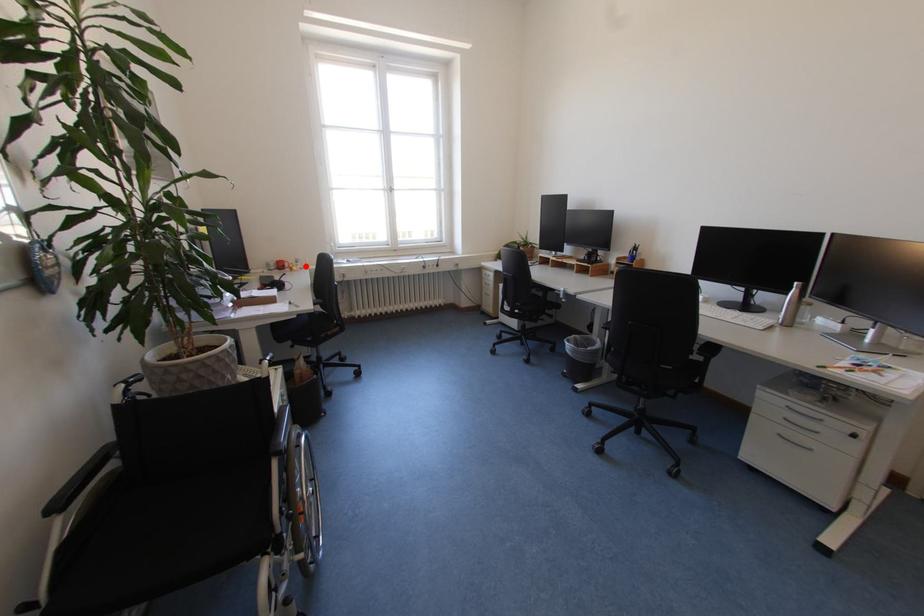
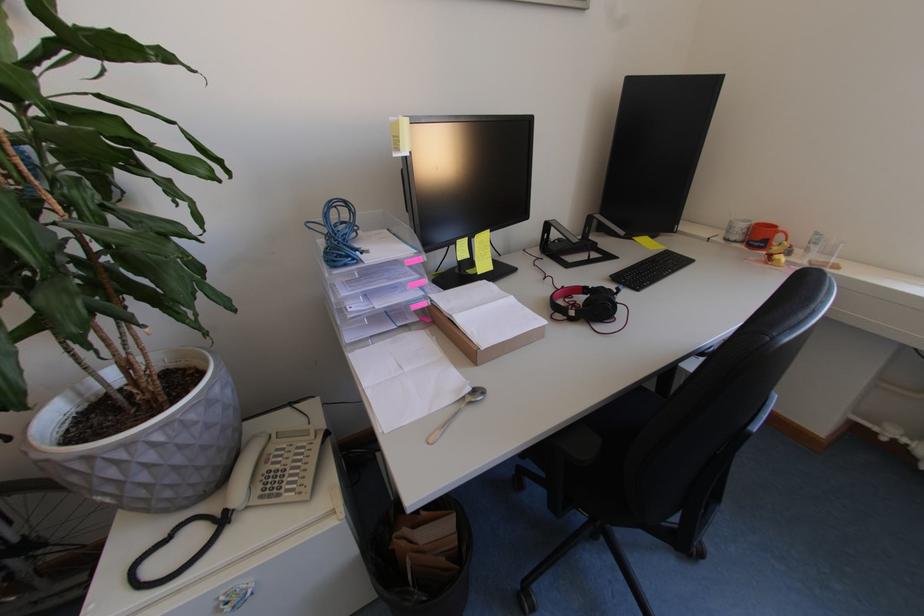
Find the pixel in the second image that matches the highlighted location in the first image.

(816, 253)